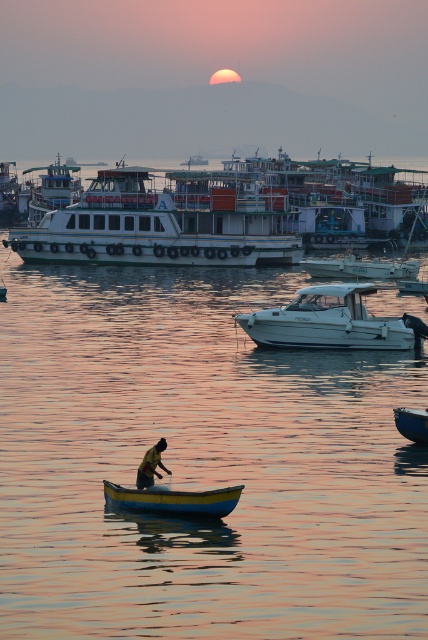
You are a photographer trying to capture the sunset scene. You want to ensure the white glossy boat at center and the yellow fabric shirt at lower center are both visible in your shot. Based on their positions, which object should be placed closer to the right side of the frame?

The white glossy boat at center should be placed closer to the right side of the frame because it is to the right of the yellow fabric shirt at lower center.

You are a photographer trying to capture the sunset scene. You notice the white glossy boat at center and the yellow fabric shirt at lower center. Which object is closer to the camera, based on their positions in the image?

The white glossy boat at center is positioned over the yellow fabric shirt at lower center, meaning it is closer to the camera.